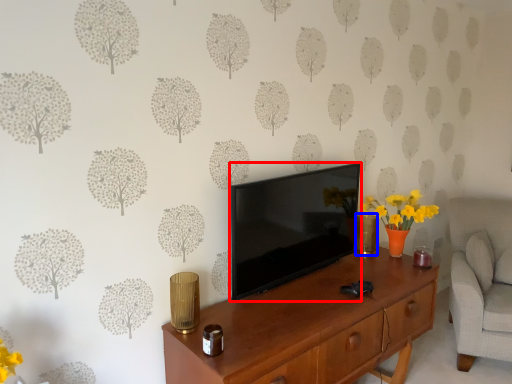
Question: Which of the following is the farthest to the observer, television (highlighted by a red box) or vase (highlighted by a blue box)?

Choices:
 (A) television
 (B) vase

Answer: (B)